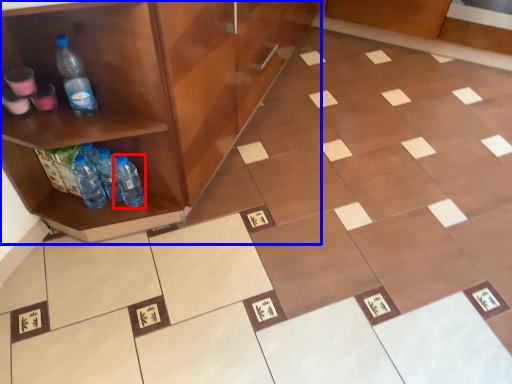
Question: Which object is closer to the camera taking this photo, bottle (highlighted by a red box) or cabinetry (highlighted by a blue box)?

Choices:
 (A) bottle
 (B) cabinetry

Answer: (B)